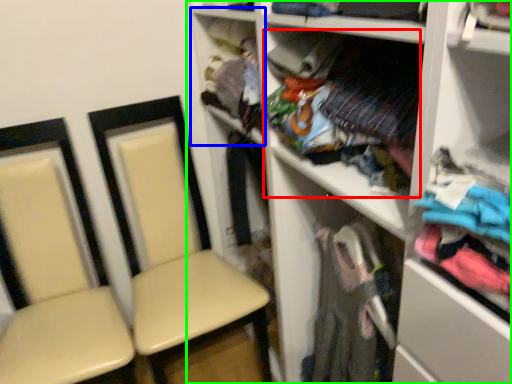
Question: Which is farther away from clothing (highlighted by a red box)? cabinet (highlighted by a blue box) or shelf (highlighted by a green box)?

Choices:
 (A) cabinet
 (B) shelf

Answer: (A)